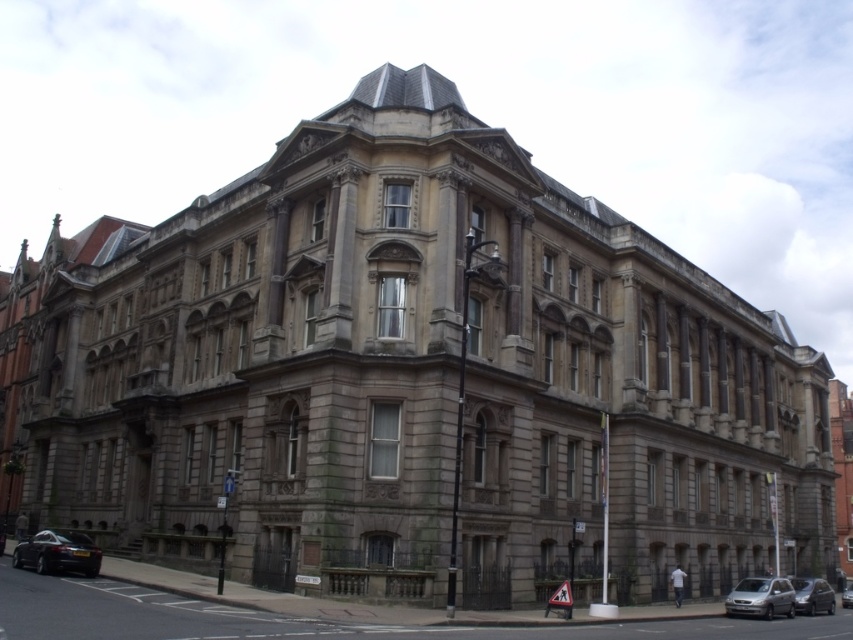
Can you confirm if metallic silver car at lower right is positioned below metallic silver car at center?

Incorrect, metallic silver car at lower right is not positioned below metallic silver car at center.

Is point (827, 586) farther from camera compared to point (846, 586)?

No, (827, 586) is in front of (846, 586).

This screenshot has height=640, width=853. In order to click on metallic silver car at lower right in this screenshot , I will do `click(811, 595)`.

Does silver metallic van at lower right appear under metallic silver car at center?

No.

Measure the distance between point (743, 608) and camera.

62.73 meters

Is point (744, 586) more distant than point (849, 596)?

No.

I want to click on silver metallic van at lower right, so click(x=759, y=596).

Identify the location of silver metallic van at lower right. Image resolution: width=853 pixels, height=640 pixels. (759, 596).

Who is positioned more to the right, silver metallic van at lower right or metallic silver car at lower right?

Positioned to the right is metallic silver car at lower right.

Where is `silver metallic van at lower right`? The height and width of the screenshot is (640, 853). silver metallic van at lower right is located at coordinates (759, 596).

The width and height of the screenshot is (853, 640). In order to click on silver metallic van at lower right in this screenshot , I will do `click(759, 596)`.